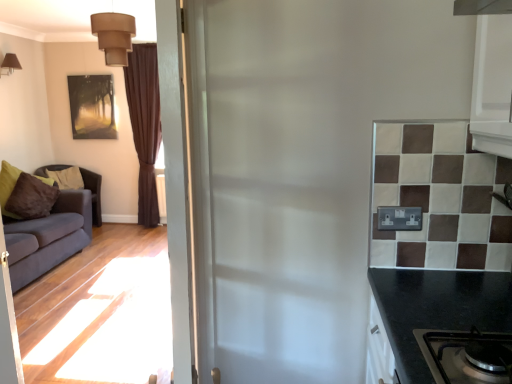
Question: Should I look upward or downward to see matte brown fabric couch at left, placed as the first studio couch when sorted from back to front?

Choices:
 (A) up
 (B) down

Answer: (B)

Question: From the image's perspective, is matte gold picture frame at upper left beneath white glossy door at center?

Choices:
 (A) no
 (B) yes

Answer: (A)

Question: From a real-world perspective, is matte gold picture frame at upper left on white glossy door at center?

Choices:
 (A) no
 (B) yes

Answer: (B)

Question: Is matte gold picture frame at upper left next to white glossy door at center and touching it?

Choices:
 (A) no
 (B) yes

Answer: (A)

Question: Is matte gold picture frame at upper left taller than white glossy door at center?

Choices:
 (A) no
 (B) yes

Answer: (A)

Question: Is matte gold picture frame at upper left positioned with its back to white glossy door at center?

Choices:
 (A) yes
 (B) no

Answer: (B)

Question: Does matte gold picture frame at upper left have a greater width compared to white glossy door at center?

Choices:
 (A) yes
 (B) no

Answer: (A)

Question: Does matte gold picture frame at upper left appear on the left side of matte brown fabric couch at left, the second studio couch when ordered from front to back?

Choices:
 (A) yes
 (B) no

Answer: (B)

Question: Is matte gold picture frame at upper left oriented away from matte brown fabric couch at left, the second studio couch when ordered from front to back?

Choices:
 (A) no
 (B) yes

Answer: (A)

Question: Could matte brown fabric couch at left, placed as the first studio couch when sorted from back to front, be considered to be inside matte gold picture frame at upper left?

Choices:
 (A) no
 (B) yes

Answer: (A)

Question: Is matte gold picture frame at upper left not inside matte brown fabric couch at left, placed as the first studio couch when sorted from back to front?

Choices:
 (A) yes
 (B) no

Answer: (A)

Question: Is matte gold picture frame at upper left shorter than matte brown fabric couch at left, the second studio couch when ordered from front to back?

Choices:
 (A) yes
 (B) no

Answer: (A)

Question: Is matte gold picture frame at upper left behind matte brown fabric couch at left, placed as the first studio couch when sorted from back to front?

Choices:
 (A) yes
 (B) no

Answer: (A)

Question: Is matte brown wall light at upper left, the 1th lamp in the left-to-right sequence, at the left side of brown velvet curtain at left?

Choices:
 (A) yes
 (B) no

Answer: (A)